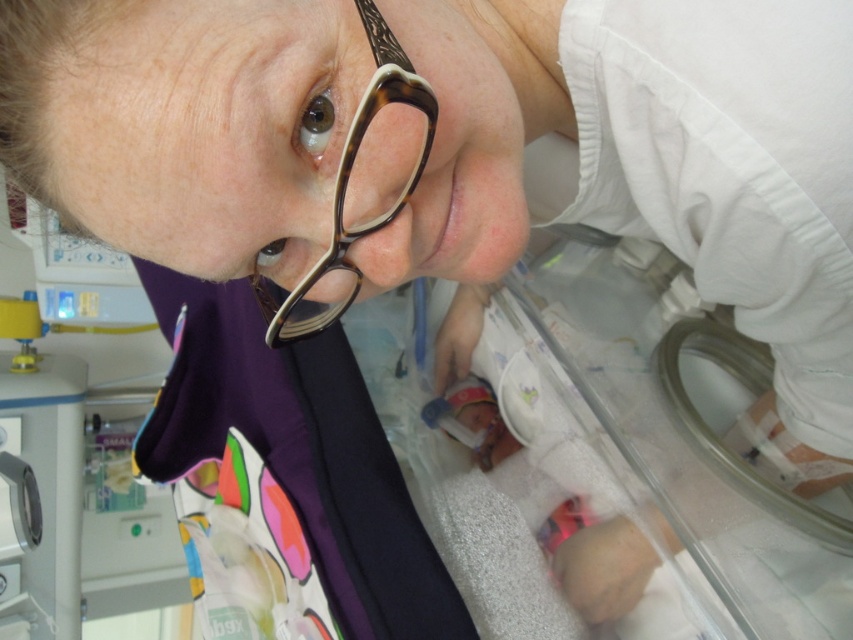
Question: Does tortoiseshell frame glasses at upper center have a greater width compared to soft white blanket at center?

Choices:
 (A) yes
 (B) no

Answer: (A)

Question: Is tortoiseshell frame glasses at upper center smaller than soft white blanket at center?

Choices:
 (A) no
 (B) yes

Answer: (A)

Question: Which point is closer to the camera taking this photo?

Choices:
 (A) (630, 605)
 (B) (426, 120)

Answer: (B)

Question: Does tortoiseshell frame glasses at upper center appear under soft white blanket at center?

Choices:
 (A) yes
 (B) no

Answer: (B)

Question: Which point is farther to the camera?

Choices:
 (A) (469, 312)
 (B) (376, 113)

Answer: (A)